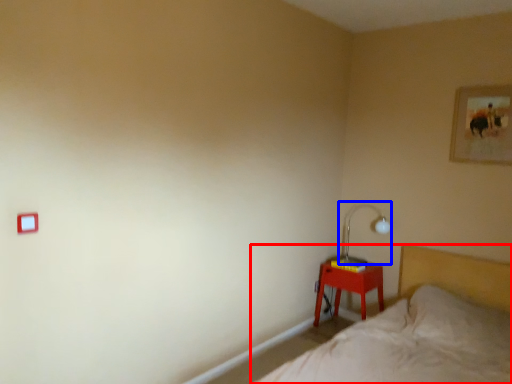
Question: Which of the following is the farthest to the observer, bed (highlighted by a red box) or table lamp (highlighted by a blue box)?

Choices:
 (A) bed
 (B) table lamp

Answer: (B)